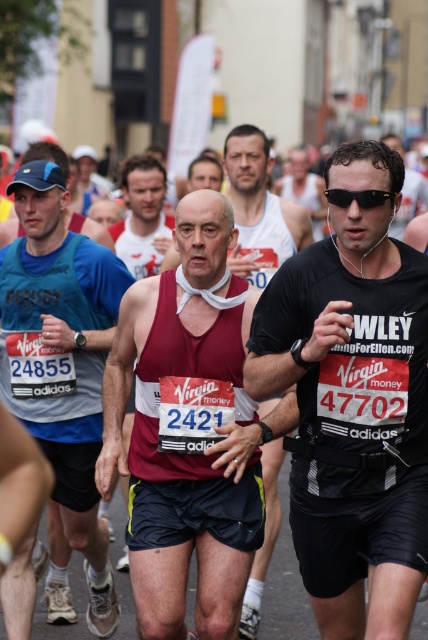
You are a photographer standing at the starting line of the marathon. You want to take a closeup photo of the maroon tank top at center. Considering the distance, will you need a zoom lens?

The maroon tank top at center is 7.68 meters from viewer, so a zoom lens would be necessary to capture a closeup photo from that distance.